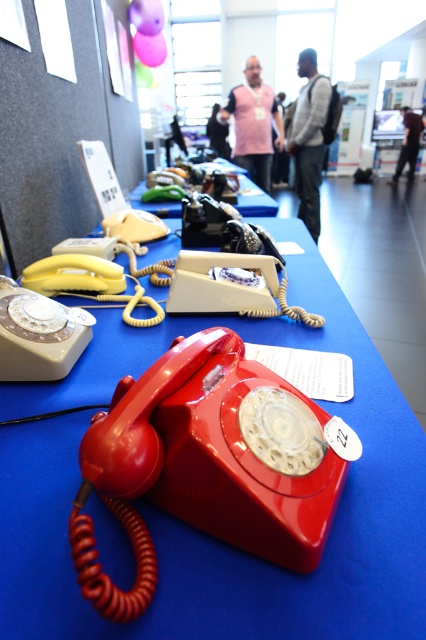
Question: Can you confirm if matte red telephone at center is positioned below black fabric person at center?

Choices:
 (A) yes
 (B) no

Answer: (A)

Question: Among these points, which one is nearest to the camera?

Choices:
 (A) (259, 211)
 (B) (126, 163)
 (C) (348, 326)
 (D) (412, 166)

Answer: (C)

Question: From the image, what is the correct spatial relationship of matte red telephone at center in relation to matte black telephone at center?

Choices:
 (A) right
 (B) left

Answer: (B)

Question: Which of these objects is positioned closest to the gray sweater at center?

Choices:
 (A) matte black telephone at center
 (B) black fabric person at center
 (C) matte red telephone at center

Answer: (A)

Question: Which object appears closest to the camera in this image?

Choices:
 (A) pink fabric vest at center
 (B) black fabric person at center

Answer: (A)

Question: Can you confirm if gray sweater at center is bigger than black fabric person at center?

Choices:
 (A) yes
 (B) no

Answer: (A)